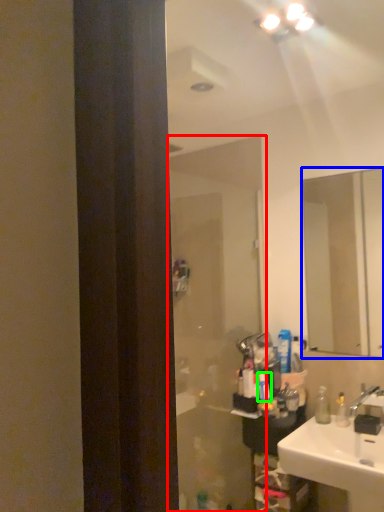
Question: Which object is the closest to the screen door (highlighted by a red box)? Choose among these: mirror (highlighted by a blue box) or toiletry (highlighted by a green box).

Choices:
 (A) mirror
 (B) toiletry

Answer: (B)